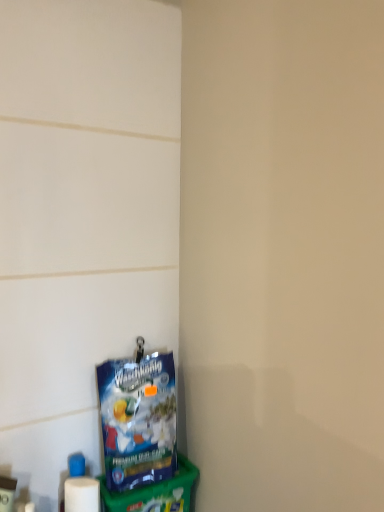
Question: Is white plastic container at lower left spatially inside blue plastic bag at lower left, or outside of it?

Choices:
 (A) inside
 (B) outside

Answer: (B)

Question: Is point (3, 478) closer or farther from the camera than point (130, 437)?

Choices:
 (A) farther
 (B) closer

Answer: (B)

Question: Is white plastic container at lower left taller or shorter than blue plastic bag at lower left?

Choices:
 (A) short
 (B) tall

Answer: (A)

Question: Does point (135, 415) appear closer or farther from the camera than point (4, 477)?

Choices:
 (A) closer
 (B) farther

Answer: (B)

Question: From the image's perspective, relative to white plastic container at lower left, is blue plastic bag at lower left above or below?

Choices:
 (A) below
 (B) above

Answer: (B)

Question: Is blue plastic bag at lower left taller or shorter than white plastic container at lower left?

Choices:
 (A) tall
 (B) short

Answer: (A)

Question: Is blue plastic bag at lower left to the left or to the right of white plastic container at lower left in the image?

Choices:
 (A) right
 (B) left

Answer: (A)